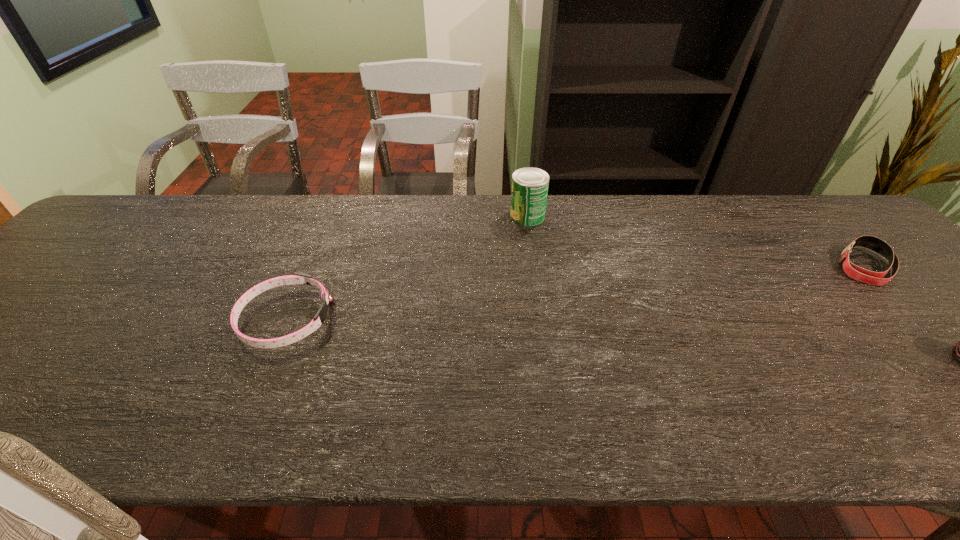
The height and width of the screenshot is (540, 960). I want to click on free location that satisfies the following two spatial constraints: 1. on the front side of the right dog collar; 2. with the buckle on the left dog collar, so click(x=916, y=320).